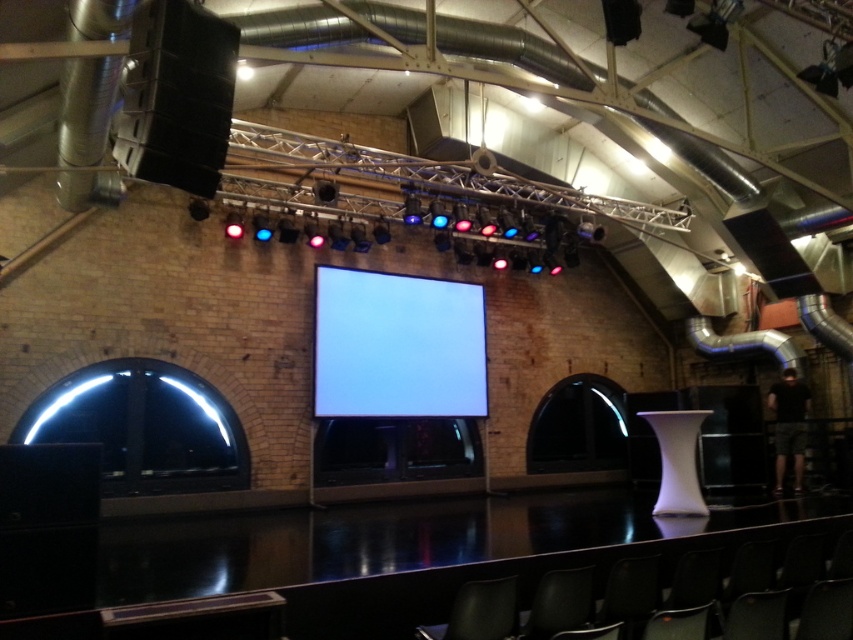
Is point (341, 387) positioned in front of point (490, 627)?

No.

Can you confirm if white glossy projection screen at center is shorter than matte black chair at lower center?

No.

The width and height of the screenshot is (853, 640). What do you see at coordinates (397, 346) in the screenshot?
I see `white glossy projection screen at center` at bounding box center [397, 346].

This screenshot has width=853, height=640. Find the location of `white glossy projection screen at center`. white glossy projection screen at center is located at coordinates (397, 346).